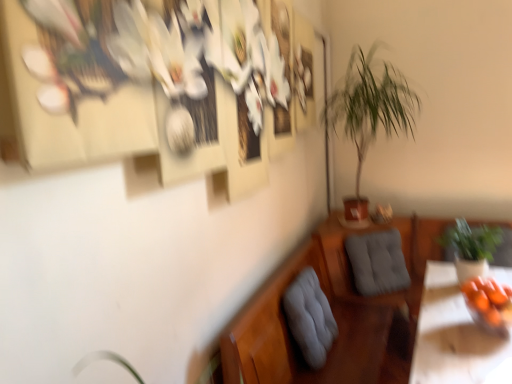
The width and height of the screenshot is (512, 384). I want to click on green leafy plant at right, marked as the 1th houseplant in a right-to-left arrangement, so click(471, 247).

This screenshot has height=384, width=512. What do you see at coordinates (370, 106) in the screenshot? I see `green leafy plant at center-right, arranged as the 2th houseplant when ordered from the bottom` at bounding box center [370, 106].

This screenshot has height=384, width=512. Find the location of `orange matte bowl at lower right`. orange matte bowl at lower right is located at coordinates (489, 301).

This screenshot has width=512, height=384. What do you see at coordinates (378, 263) in the screenshot?
I see `gray fabric swivel chair at center, marked as the 2th swivel chair in a front-to-back arrangement` at bounding box center [378, 263].

At what (x,y) coordinates should I click in order to perform the action: click on green leafy plant at right, marked as the 1th houseplant in a right-to-left arrangement. Please return your answer as a coordinate pair (x, y). Looking at the image, I should click on (471, 247).

Is point (493, 297) less distant than point (454, 250)?

That is True.

Measure the distance between orange matte bowl at lower right and green leafy plant at right, the second houseplant from the left.

A distance of 25.87 centimeters exists between orange matte bowl at lower right and green leafy plant at right, the second houseplant from the left.

Is orange matte bowl at lower right behind green leafy plant at right, marked as the 1th houseplant in a right-to-left arrangement?

That is False.

Which is correct: orange matte bowl at lower right is inside green leafy plant at right, which ranks as the second houseplant in top-to-bottom order, or outside of it?

orange matte bowl at lower right is not inside green leafy plant at right, which ranks as the second houseplant in top-to-bottom order, it's outside.

Is orange matte bowl at lower right next to gray fabric cushion at lower center, arranged as the second swivel chair when viewed from the right, and touching it?

No, orange matte bowl at lower right is not making contact with gray fabric cushion at lower center, arranged as the second swivel chair when viewed from the right.

Can we say orange matte bowl at lower right lies outside gray fabric cushion at lower center, which is the 1th swivel chair in front-to-back order?

orange matte bowl at lower right is positioned outside gray fabric cushion at lower center, which is the 1th swivel chair in front-to-back order.

From a real-world perspective, is orange matte bowl at lower right located beneath gray fabric cushion at lower center, the 1th swivel chair in the left-to-right sequence?

No, from a real-world perspective, orange matte bowl at lower right is not under gray fabric cushion at lower center, the 1th swivel chair in the left-to-right sequence.

Between orange matte bowl at lower right and gray fabric cushion at lower center, which ranks as the second swivel chair in back-to-front order, which one has larger width?

orange matte bowl at lower right is wider.

Between green leafy plant at right, the second houseplant from the left, and green leafy plant at center-right, which appears as the 1th houseplant when viewed from the left, which one has smaller width?

green leafy plant at right, the second houseplant from the left.

From the picture: Considering the relative sizes of green leafy plant at right, the second houseplant from the left, and green leafy plant at center-right, which appears as the 1th houseplant when viewed from the top, in the image provided, is green leafy plant at right, the second houseplant from the left, smaller than green leafy plant at center-right, which appears as the 1th houseplant when viewed from the top,?

Indeed, green leafy plant at right, the second houseplant from the left, has a smaller size compared to green leafy plant at center-right, which appears as the 1th houseplant when viewed from the top.

Are green leafy plant at right, which ranks as the second houseplant in top-to-bottom order, and green leafy plant at center-right, which appears as the 1th houseplant when viewed from the top, located far from each other?

green leafy plant at right, which ranks as the second houseplant in top-to-bottom order, is actually quite close to green leafy plant at center-right, which appears as the 1th houseplant when viewed from the top.

Is point (464, 243) positioned after point (397, 80)?

No, it is not.

Who is shorter, gray fabric swivel chair at center, arranged as the 2th swivel chair when viewed from the left, or orange matte bowl at lower right?

Standing shorter between the two is orange matte bowl at lower right.

Which object is more forward, gray fabric swivel chair at center, marked as the 1th swivel chair in a back-to-front arrangement, or orange matte bowl at lower right?

orange matte bowl at lower right is more forward.

Does point (355, 283) come in front of point (503, 320)?

That is False.

Considering the sizes of objects gray fabric swivel chair at center, arranged as the 2th swivel chair when viewed from the left, and orange matte bowl at lower right in the image provided, who is thinner, gray fabric swivel chair at center, arranged as the 2th swivel chair when viewed from the left, or orange matte bowl at lower right?

With smaller width is gray fabric swivel chair at center, arranged as the 2th swivel chair when viewed from the left.

Can orange matte bowl at lower right be found inside green leafy plant at right, the 1th houseplant when ordered from bottom to top?

No, orange matte bowl at lower right is not surrounded by green leafy plant at right, the 1th houseplant when ordered from bottom to top.

From a real-world perspective, is green leafy plant at right, which ranks as the second houseplant in top-to-bottom order, physically located above or below orange matte bowl at lower right?

green leafy plant at right, which ranks as the second houseplant in top-to-bottom order, is below orange matte bowl at lower right.

Considering the positions of point (445, 247) and point (500, 322), is point (445, 247) closer or farther from the camera than point (500, 322)?

Point (445, 247) is farther from the camera than point (500, 322).

Is green leafy plant at right, marked as the 1th houseplant in a right-to-left arrangement, far away from orange matte bowl at lower right?

green leafy plant at right, marked as the 1th houseplant in a right-to-left arrangement, is actually quite close to orange matte bowl at lower right.

Is orange matte bowl at lower right oriented away from gray fabric swivel chair at center, marked as the 1th swivel chair in a back-to-front arrangement?

That's not correct — orange matte bowl at lower right is not looking away from gray fabric swivel chair at center, marked as the 1th swivel chair in a back-to-front arrangement.

From a real-world perspective, is orange matte bowl at lower right on top of gray fabric swivel chair at center, acting as the first swivel chair starting from the right?

Yes, from a real-world perspective, orange matte bowl at lower right is on top of gray fabric swivel chair at center, acting as the first swivel chair starting from the right.

In the image, is orange matte bowl at lower right on the left side or the right side of gray fabric swivel chair at center, arranged as the 2th swivel chair when viewed from the left?

From the image, it's evident that orange matte bowl at lower right is to the right of gray fabric swivel chair at center, arranged as the 2th swivel chair when viewed from the left.

Would you say orange matte bowl at lower right is a long distance from gray fabric swivel chair at center, arranged as the 2th swivel chair when viewed from the left?

No, orange matte bowl at lower right is not far away from gray fabric swivel chair at center, arranged as the 2th swivel chair when viewed from the left.

From a real-world perspective, relative to gray fabric swivel chair at center, marked as the 2th swivel chair in a front-to-back arrangement, is gray fabric cushion at lower center, which ranks as the second swivel chair in back-to-front order, vertically above or below?

In terms of real-world spatial position, gray fabric cushion at lower center, which ranks as the second swivel chair in back-to-front order, is below gray fabric swivel chair at center, marked as the 2th swivel chair in a front-to-back arrangement.

From the picture: Can you confirm if gray fabric cushion at lower center, which is the 1th swivel chair in front-to-back order, is taller than gray fabric swivel chair at center, arranged as the 2th swivel chair when viewed from the left?

Yes, gray fabric cushion at lower center, which is the 1th swivel chair in front-to-back order, is taller than gray fabric swivel chair at center, arranged as the 2th swivel chair when viewed from the left.

From the image's perspective, which one is positioned higher, gray fabric cushion at lower center, which is the 1th swivel chair in front-to-back order, or gray fabric swivel chair at center, arranged as the 2th swivel chair when viewed from the left?

gray fabric swivel chair at center, arranged as the 2th swivel chair when viewed from the left, appears higher in the image.

Can you confirm if gray fabric cushion at lower center, arranged as the second swivel chair when viewed from the right, is bigger than gray fabric swivel chair at center, marked as the 2th swivel chair in a front-to-back arrangement?

Yes.

Find the location of a particular element. food in front of the green leafy plant at right, marked as the 1th houseplant in a right-to-left arrangement is located at coordinates (489, 301).

Where is `food above the gray fabric cushion at lower center, which is the 1th swivel chair in front-to-back order (from a real-world perspective)`? The image size is (512, 384). food above the gray fabric cushion at lower center, which is the 1th swivel chair in front-to-back order (from a real-world perspective) is located at coordinates (489, 301).

From the image, which object appears to be farther from orange matte bowl at lower right, green leafy plant at right, marked as the 1th houseplant in a right-to-left arrangement, or gray fabric swivel chair at center, marked as the 1th swivel chair in a back-to-front arrangement?

Based on the image, gray fabric swivel chair at center, marked as the 1th swivel chair in a back-to-front arrangement, appears to be further to orange matte bowl at lower right.

Which object lies nearer to the anchor point orange matte bowl at lower right, green leafy plant at center-right, arranged as the 2th houseplant when ordered from the bottom, or green leafy plant at right, the 1th houseplant when ordered from bottom to top?

Among the two, green leafy plant at right, the 1th houseplant when ordered from bottom to top, is located nearer to orange matte bowl at lower right.

Estimate the real-world distances between objects in this image. Which object is closer to green leafy plant at right, which ranks as the second houseplant in top-to-bottom order, gray fabric cushion at lower center, arranged as the second swivel chair when viewed from the right, or green leafy plant at center-right, which appears as the 1th houseplant when viewed from the top?

The object closer to green leafy plant at right, which ranks as the second houseplant in top-to-bottom order, is gray fabric cushion at lower center, arranged as the second swivel chair when viewed from the right.

From the image, which object appears to be nearer to green leafy plant at center-right, which appears as the 1th houseplant when viewed from the left, green leafy plant at right, the second houseplant from the left, or gray fabric swivel chair at center, marked as the 2th swivel chair in a front-to-back arrangement?

Among the two, gray fabric swivel chair at center, marked as the 2th swivel chair in a front-to-back arrangement, is located nearer to green leafy plant at center-right, which appears as the 1th houseplant when viewed from the left.

Estimate the real-world distances between objects in this image. Which object is further from gray fabric swivel chair at center, marked as the 2th swivel chair in a front-to-back arrangement, gray fabric cushion at lower center, the 1th swivel chair in the left-to-right sequence, or green leafy plant at right, the 1th houseplant when ordered from bottom to top?

gray fabric cushion at lower center, the 1th swivel chair in the left-to-right sequence, lies further to gray fabric swivel chair at center, marked as the 2th swivel chair in a front-to-back arrangement, than the other object.

Looking at the image, which one is located further to green leafy plant at right, the 1th houseplant when ordered from bottom to top, green leafy plant at center-right, arranged as the 2th houseplant when ordered from the bottom, or gray fabric cushion at lower center, arranged as the second swivel chair when viewed from the right?

green leafy plant at center-right, arranged as the 2th houseplant when ordered from the bottom, is further to green leafy plant at right, the 1th houseplant when ordered from bottom to top.

Looking at the image, which one is located closer to gray fabric cushion at lower center, which is the 1th swivel chair in front-to-back order, green leafy plant at right, the 1th houseplant when ordered from bottom to top, or green leafy plant at center-right, which appears as the 1th houseplant when viewed from the left?

green leafy plant at right, the 1th houseplant when ordered from bottom to top.

Looking at the image, which one is located closer to green leafy plant at right, which ranks as the second houseplant in top-to-bottom order, green leafy plant at center-right, which is the second houseplant from right to left, or gray fabric swivel chair at center, marked as the 1th swivel chair in a back-to-front arrangement?

Among the two, gray fabric swivel chair at center, marked as the 1th swivel chair in a back-to-front arrangement, is located nearer to green leafy plant at right, which ranks as the second houseplant in top-to-bottom order.

Find the location of a particular element. swivel chair positioned between orange matte bowl at lower right and gray fabric swivel chair at center, marked as the 2th swivel chair in a front-to-back arrangement, from near to far is located at coordinates (310, 318).

In order to click on swivel chair located between gray fabric cushion at lower center, arranged as the second swivel chair when viewed from the right, and green leafy plant at right, which ranks as the second houseplant in top-to-bottom order, in the left-right direction in this screenshot , I will do `click(378, 263)`.

Where is `houseplant between green leafy plant at center-right, arranged as the 2th houseplant when ordered from the bottom, and gray fabric swivel chair at center, acting as the first swivel chair starting from the right, vertically`? The image size is (512, 384). houseplant between green leafy plant at center-right, arranged as the 2th houseplant when ordered from the bottom, and gray fabric swivel chair at center, acting as the first swivel chair starting from the right, vertically is located at coordinates (471, 247).

Identify the location of food between green leafy plant at center-right, arranged as the 2th houseplant when ordered from the bottom, and gray fabric cushion at lower center, the 1th swivel chair in the left-to-right sequence, in the up-down direction. (489, 301).